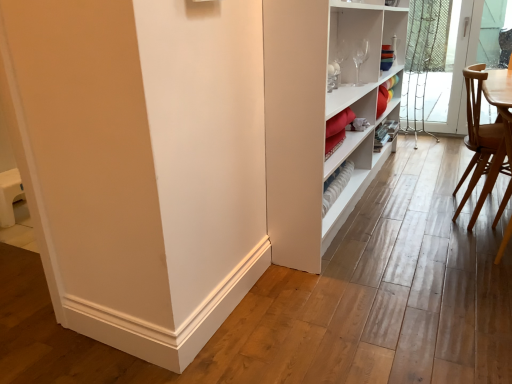
The height and width of the screenshot is (384, 512). I want to click on light brown wooden chair at right, so click(x=481, y=135).

Describe the element at coordinates (481, 135) in the screenshot. I see `light brown wooden chair at right` at that location.

What do you see at coordinates (449, 74) in the screenshot?
I see `clear glass screen door at right` at bounding box center [449, 74].

This screenshot has height=384, width=512. Identify the location of clear glass screen door at right. (449, 74).

In order to click on light brown wooden chair at right in this screenshot , I will do `click(481, 135)`.

Is clear glass screen door at right to the right of light brown wooden chair at right from the viewer's perspective?

Correct, you'll find clear glass screen door at right to the right of light brown wooden chair at right.

Which object is closer to the camera taking this photo, clear glass screen door at right or light brown wooden chair at right?

Positioned in front is light brown wooden chair at right.

Which is nearer, (464, 126) or (485, 91)?

Clearly, point (464, 126) is more distant from the camera than point (485, 91).

From the image's perspective, is clear glass screen door at right on top of light brown wooden chair at right?

Yes, from the image's perspective, clear glass screen door at right is over light brown wooden chair at right.

From a real-world perspective, which object stands above the other?

clear glass screen door at right.

Considering the relative sizes of clear glass screen door at right and light brown wooden chair at right in the image provided, is clear glass screen door at right thinner than light brown wooden chair at right?

Correct, the width of clear glass screen door at right is less than that of light brown wooden chair at right.

Is clear glass screen door at right shorter than light brown wooden chair at right?

No, clear glass screen door at right is not shorter than light brown wooden chair at right.

Which of these two, clear glass screen door at right or light brown wooden chair at right, is bigger?

light brown wooden chair at right is bigger.

Based on the photo, is clear glass screen door at right not within light brown wooden chair at right?

Yes, clear glass screen door at right is outside of light brown wooden chair at right.

Are clear glass screen door at right and light brown wooden chair at right far apart?

clear glass screen door at right is far away from light brown wooden chair at right.

Is clear glass screen door at right oriented towards light brown wooden chair at right?

Yes, clear glass screen door at right is oriented towards light brown wooden chair at right.

Find the location of a particular element. The width and height of the screenshot is (512, 384). screen door located behind the light brown wooden chair at right is located at coordinates (449, 74).

Does light brown wooden chair at right appear on the left side of clear glass screen door at right?

Correct, you'll find light brown wooden chair at right to the left of clear glass screen door at right.

In the image, is light brown wooden chair at right positioned in front of or behind clear glass screen door at right?

In the image, light brown wooden chair at right appears in front of clear glass screen door at right.

Which point is more distant from viewer, (474, 173) or (455, 95)?

The point (455, 95) is farther from the camera.

From the image's perspective, is light brown wooden chair at right positioned above or below clear glass screen door at right?

Based on their image positions, light brown wooden chair at right is located beneath clear glass screen door at right.

Looking at this image, from a real-world perspective, which is physically above, light brown wooden chair at right or clear glass screen door at right?

clear glass screen door at right is physically above.

Considering the sizes of light brown wooden chair at right and clear glass screen door at right in the image, is light brown wooden chair at right wider or thinner than clear glass screen door at right?

Considering their sizes, light brown wooden chair at right looks broader than clear glass screen door at right.

Based on the photo, which of these two, light brown wooden chair at right or clear glass screen door at right, stands shorter?

Standing shorter between the two is light brown wooden chair at right.

From the picture: Can you confirm if light brown wooden chair at right is smaller than clear glass screen door at right?

No, light brown wooden chair at right is not smaller than clear glass screen door at right.

Is light brown wooden chair at right located outside clear glass screen door at right?

Indeed, light brown wooden chair at right is completely outside clear glass screen door at right.

Is light brown wooden chair at right far away from clear glass screen door at right?

light brown wooden chair at right is far away from clear glass screen door at right.

Is light brown wooden chair at right turned away from clear glass screen door at right?

No, light brown wooden chair at right is not facing away from clear glass screen door at right.

Identify the location of chair that is in front of the clear glass screen door at right. (481, 135).

Identify the location of screen door located above the light brown wooden chair at right (from a real-world perspective). (449, 74).

You are a GUI agent. You are given a task and a screenshot of the screen. Output one action in this format:
    pyautogui.click(x=<x>, y=<y>)
    Task: Click on the chair below the clear glass screen door at right (from the image's perspective)
    The width and height of the screenshot is (512, 384).
    Given the screenshot: What is the action you would take?
    pyautogui.click(x=481, y=135)